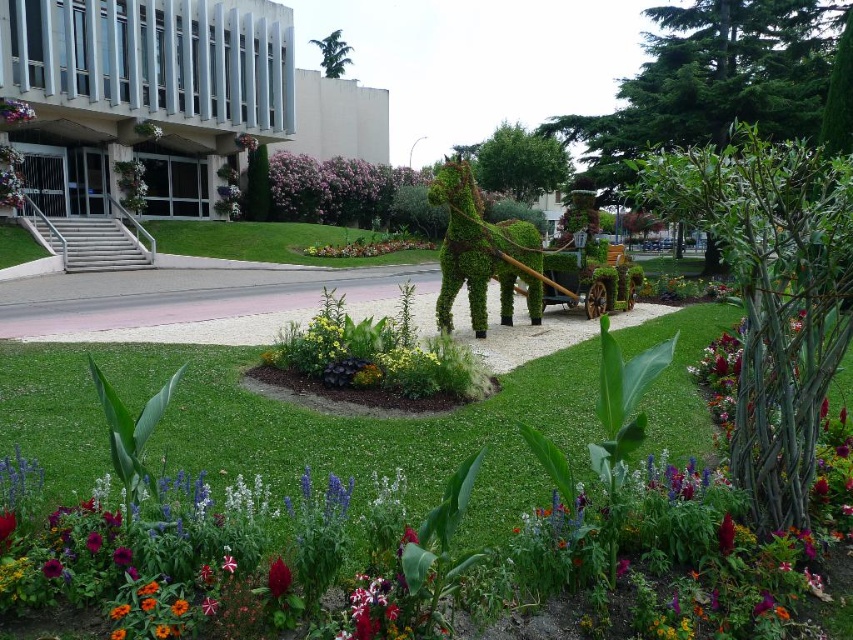
Question: Does purple matte flower at upper center appear on the right side of vivid red petal at center?

Choices:
 (A) yes
 (B) no

Answer: (B)

Question: Can you confirm if purple matte flower at upper center is bigger than vivid red petal at center?

Choices:
 (A) no
 (B) yes

Answer: (B)

Question: Considering the real-world distances, which object is farthest from the vivid red petal at lower left?

Choices:
 (A) green leafy material wagon at center
 (B) green leafy horse at center
 (C) purple matte flower at upper center
 (D) deep red petal at center

Answer: (C)

Question: Among these objects, which one is farthest from the camera?

Choices:
 (A) vivid crimson petal at lower center
 (B) green leafy material wagon at center
 (C) green leafy horse at center

Answer: (B)

Question: In this image, where is green leafy material wagon at center located relative to vivid red petal at center?

Choices:
 (A) left
 (B) right

Answer: (B)

Question: Considering the real-world distances, which object is closest to the purple matte flower at upper center?

Choices:
 (A) vivid red petal at center
 (B) green leafy horse at center
 (C) green leafy material wagon at center

Answer: (B)